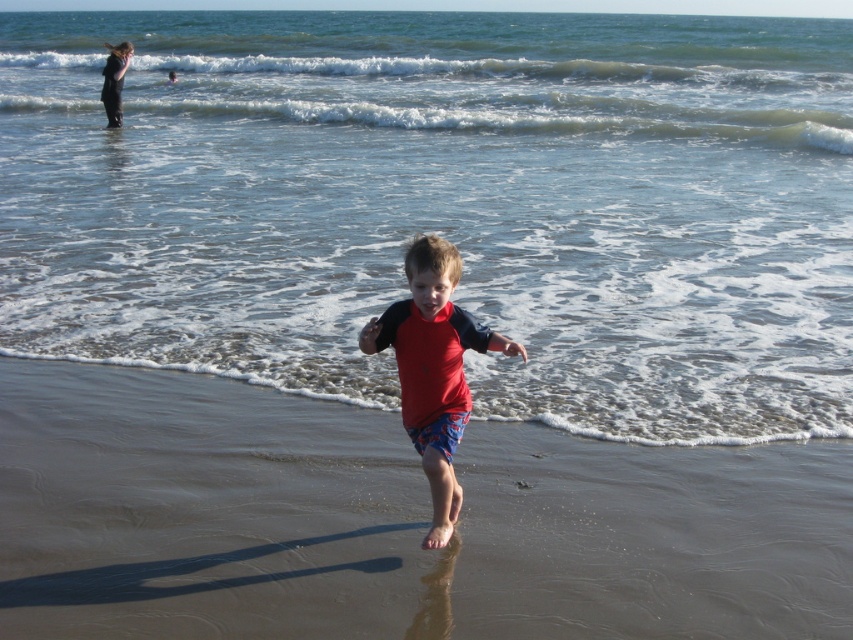
Question: Does clear water at lower center appear on the left side of black neoprene wetsuit at upper left?

Choices:
 (A) no
 (B) yes

Answer: (A)

Question: Is clear water at lower center further to camera compared to red matte swimsuit at center?

Choices:
 (A) no
 (B) yes

Answer: (B)

Question: Which point is closer to the camera?

Choices:
 (A) clear water at lower center
 (B) red matte wetsuit at center

Answer: (B)

Question: Can you confirm if red fabric shorts at center is positioned below red matte wetsuit at center?

Choices:
 (A) no
 (B) yes

Answer: (B)

Question: Which point is closer to the camera?

Choices:
 (A) (416, 384)
 (B) (109, 97)
 (C) (131, 272)

Answer: (A)

Question: Which point is closer to the camera?

Choices:
 (A) (102, 100)
 (B) (798, 145)
 (C) (512, 348)
 (D) (294, 540)

Answer: (C)